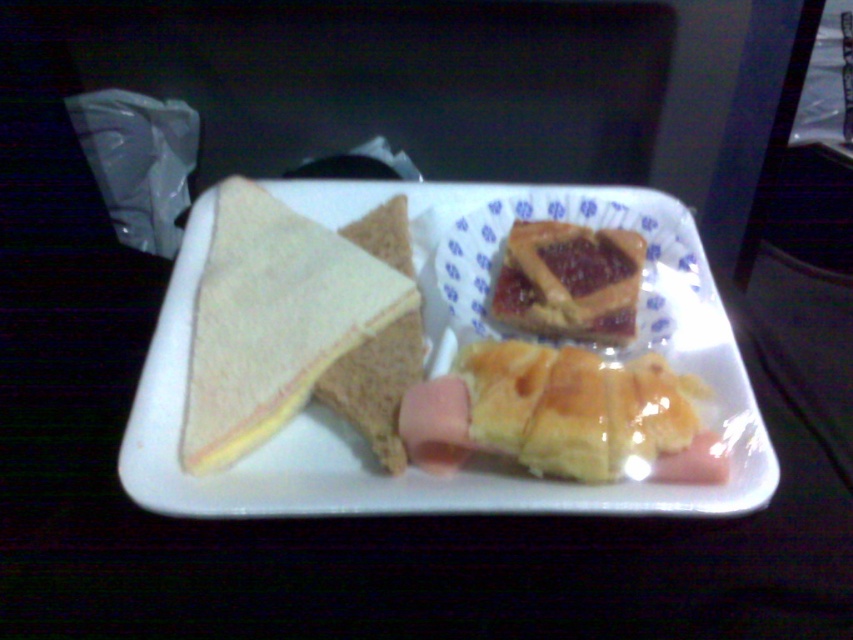
Is white paper plate at center positioned in front of golden brown flaky pastry at lower right?

Yes, it is.

How much distance is there between white paper plate at center and golden brown flaky pastry at lower right?

9.39 centimeters

Who is more distant from viewer, (409,205) or (492,401)?

The point (409,205) is more distant.

The width and height of the screenshot is (853, 640). I want to click on white paper plate at center, so click(444, 372).

Is point (247, 436) positioned in front of point (601, 284)?

Yes, point (247, 436) is closer to viewer.

Which of these two, white bread sandwich at upper left or glazed pastry at center, stands shorter?

glazed pastry at center is shorter.

Does point (370, 250) lie in front of point (494, 317)?

That is False.

Locate an element on the screen. white bread sandwich at upper left is located at coordinates click(297, 326).

Is golden brown flaky pastry at lower right closer to camera compared to glazed pastry at center?

Yes, it is.

Who is more distant from viewer, (659, 448) or (583, 264)?

Positioned behind is point (583, 264).

Is point (622, 449) positioned in front of point (611, 340)?

Yes, it is.

Find the location of a particular element. This screenshot has height=640, width=853. golden brown flaky pastry at lower right is located at coordinates coord(560,413).